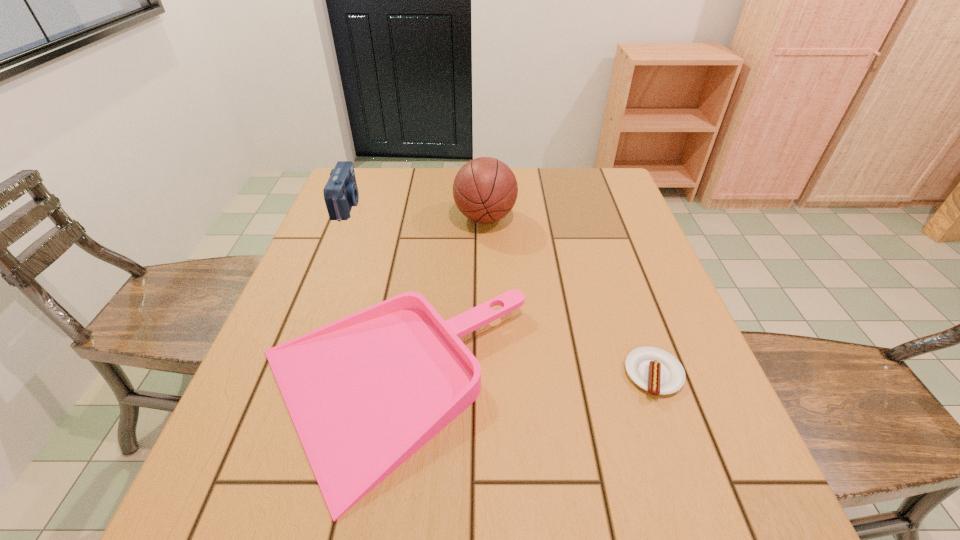
Image resolution: width=960 pixels, height=540 pixels. In the image, there is a desktop. In order to click on vacant space at the far right corner in this screenshot , I will do `click(578, 207)`.

The width and height of the screenshot is (960, 540). Find the location of `free space at the near right corner`. free space at the near right corner is located at coordinates (684, 502).

Where is `vacant area between the dustpan and the rightmost object`? This screenshot has height=540, width=960. vacant area between the dustpan and the rightmost object is located at coordinates (521, 383).

Image resolution: width=960 pixels, height=540 pixels. I want to click on vacant area between the basketball and the camera, so click(x=416, y=211).

Identify the location of free space that is in between the tallest object and the second tallest object. The width and height of the screenshot is (960, 540). (416, 211).

Where is `vacant point located between the camera and the shortest object`? vacant point located between the camera and the shortest object is located at coordinates (500, 289).

Locate an element on the screen. Image resolution: width=960 pixels, height=540 pixels. free space between the dustpan and the tallest object is located at coordinates (437, 305).

You are a GUI agent. You are given a task and a screenshot of the screen. Output one action in this format:
    pyautogui.click(x=<x>, y=<y>)
    Task: Click on the unoccupied area between the sausage and the tallest object
    The image size is (960, 540).
    Given the screenshot: What is the action you would take?
    pyautogui.click(x=569, y=296)

The width and height of the screenshot is (960, 540). In order to click on free space between the sausage and the camera in this screenshot , I will do `click(500, 289)`.

Where is `free space between the third shortest object and the second shortest object`? free space between the third shortest object and the second shortest object is located at coordinates (368, 298).